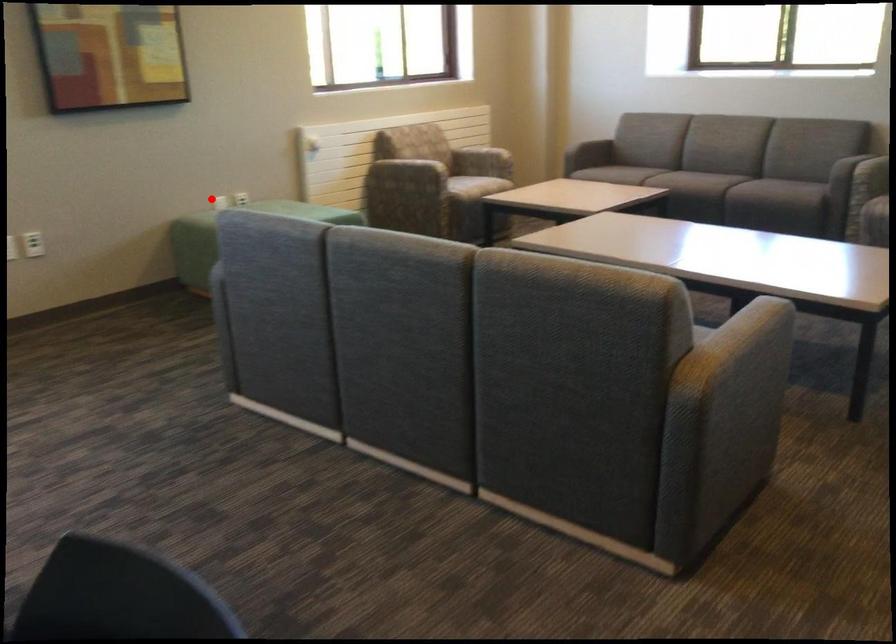
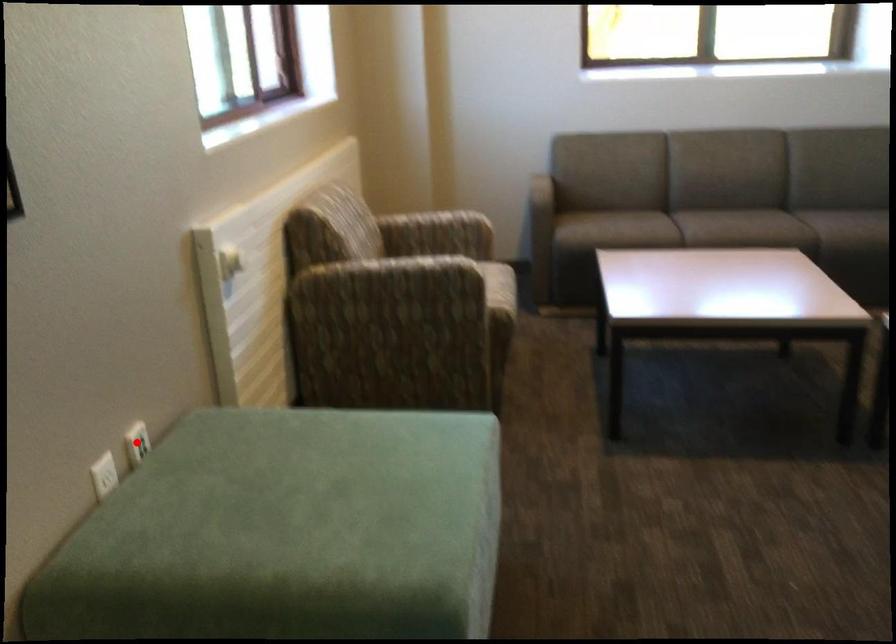
I am providing you with two images of the same scene from different viewpoints. A red point is marked on the first image and another point is marked on the second image. Is the red point in image1 aligned with the point shown in image2?

No